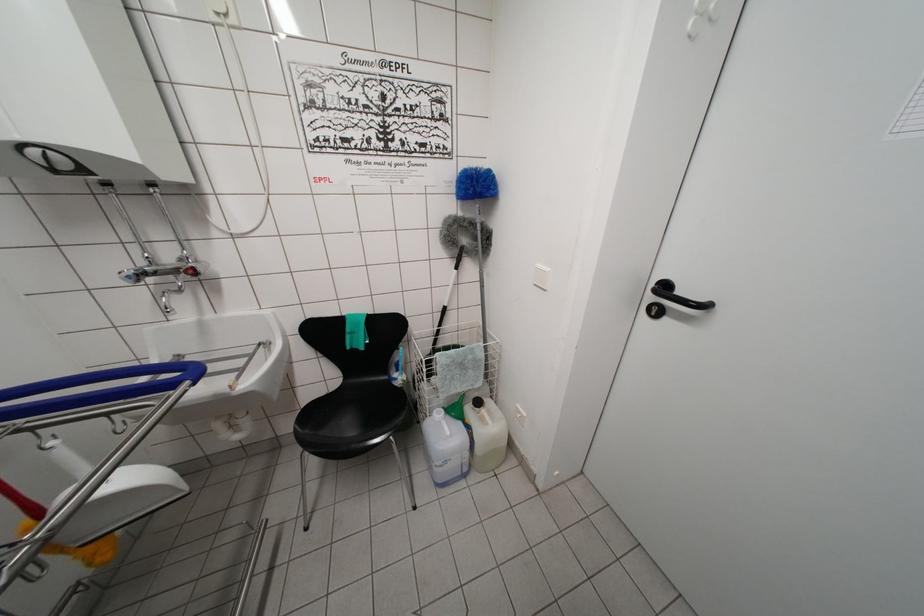
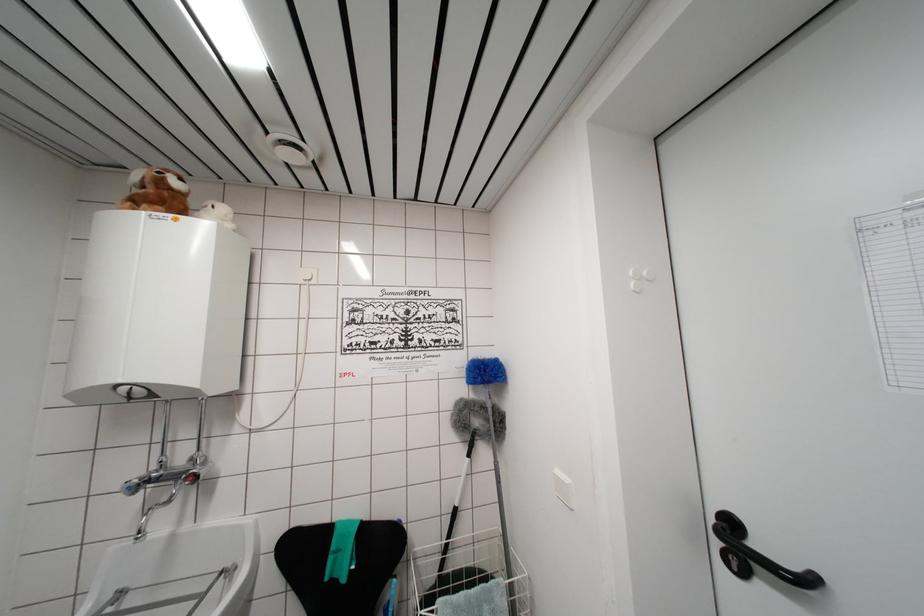
Locate, in the second image, the point that corresponds to point (254, 355) in the first image.

(209, 593)